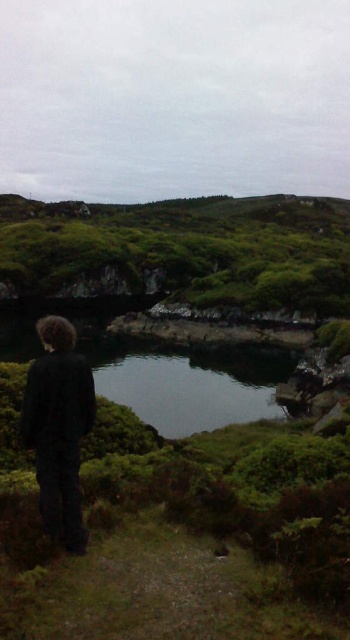
Based on the photo, you are a hiker trying to cross the terrain to reach the water at the center. You see the clear water at center and the black matte jacket at center. Which object is closer to you as you approach the water?

The clear water at center is closer to you than the black matte jacket at center because it is further to the viewer.

You are a hiker who needs to cross the clear water at center to reach the other side. You have a 100 feet long rope. The black matte jacket at center is your backpack. Can you safely cross the water using the rope?

The clear water at center is 82.63 feet away from the black matte jacket at center. Since the rope is 100 feet long, which is longer than the distance of the water, you can safely cross the water using the rope.